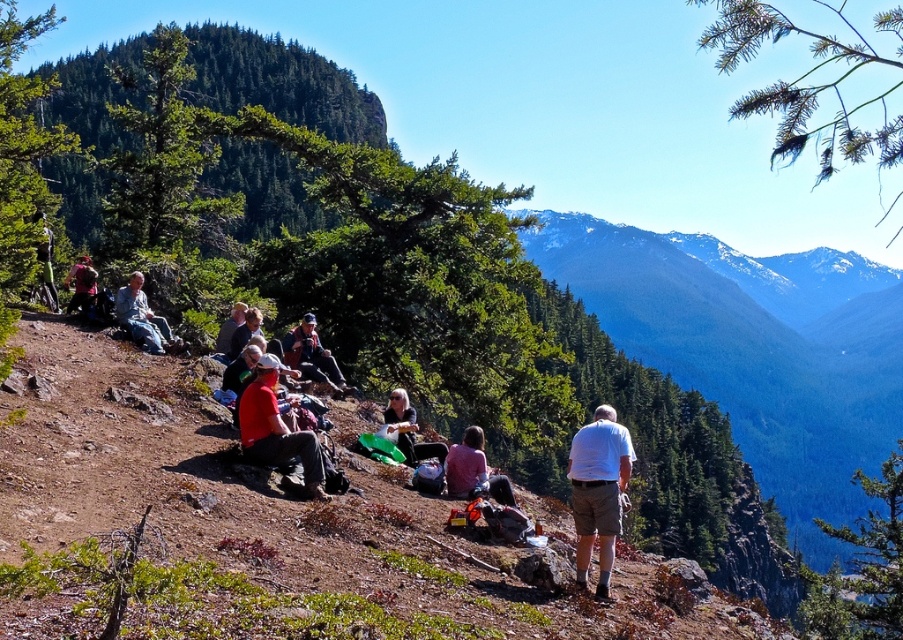
Question: In this image, where is pink fabric jacket at center located relative to matte black jacket at center?

Choices:
 (A) left
 (B) right

Answer: (B)

Question: Can you confirm if matte black backpack at left is bigger than light brown leather jacket at center?

Choices:
 (A) yes
 (B) no

Answer: (A)

Question: Can you confirm if matte red shirt at center is positioned below matte black jacket at center?

Choices:
 (A) yes
 (B) no

Answer: (B)

Question: Estimate the real-world distances between objects in this image. Which object is closer to the light brown leather jacket at center?

Choices:
 (A) matte black jacket at center
 (B) matte black backpack at left

Answer: (A)

Question: Which point is closer to the camera?

Choices:
 (A) (308, 323)
 (B) (602, 458)
 (C) (416, 456)

Answer: (B)

Question: Among these objects, which one is farthest from the camera?

Choices:
 (A) matte black jacket at center
 (B) dark gray jacket at center
 (C) denim jacket at upper left

Answer: (B)